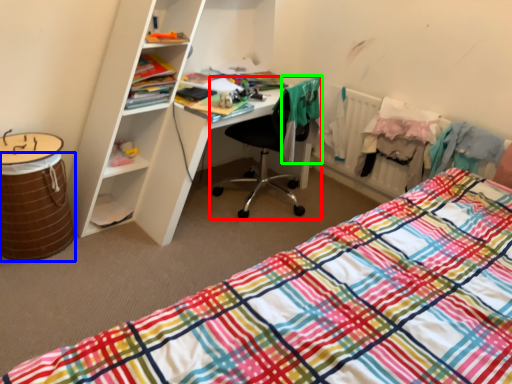
Question: Which object is the farthest from chair (highlighted by a red box)? Choose among these: barrel (highlighted by a blue box) or clothing (highlighted by a green box).

Choices:
 (A) barrel
 (B) clothing

Answer: (A)